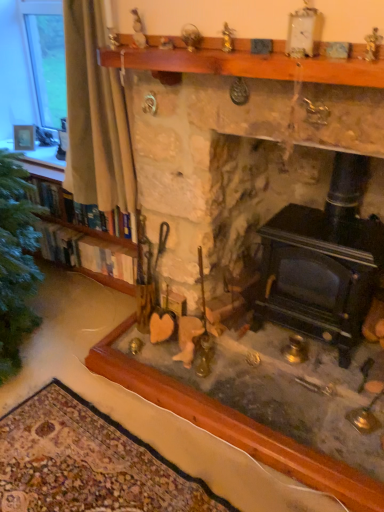
Question: Considering the relative positions of white fabric curtain at left and stone fireplace at center in the image provided, is white fabric curtain at left to the right of stone fireplace at center from the viewer's perspective?

Choices:
 (A) no
 (B) yes

Answer: (A)

Question: Considering the relative sizes of white fabric curtain at left and stone fireplace at center in the image provided, is white fabric curtain at left bigger than stone fireplace at center?

Choices:
 (A) yes
 (B) no

Answer: (B)

Question: From a real-world perspective, is white fabric curtain at left positioned under stone fireplace at center based on gravity?

Choices:
 (A) no
 (B) yes

Answer: (A)

Question: Are white fabric curtain at left and stone fireplace at center located far from each other?

Choices:
 (A) no
 (B) yes

Answer: (B)

Question: Is white fabric curtain at left thinner than stone fireplace at center?

Choices:
 (A) yes
 (B) no

Answer: (A)

Question: Is wooden bookshelf at left inside the boundaries of wooden mantle at upper center, or outside?

Choices:
 (A) outside
 (B) inside

Answer: (A)

Question: Does point (54, 223) appear closer or farther from the camera than point (299, 80)?

Choices:
 (A) farther
 (B) closer

Answer: (A)

Question: From their relative heights in the image, would you say wooden bookshelf at left is taller or shorter than wooden mantle at upper center?

Choices:
 (A) short
 (B) tall

Answer: (B)

Question: Relative to wooden mantle at upper center, is wooden bookshelf at left in front or behind?

Choices:
 (A) front
 (B) behind

Answer: (B)

Question: Is point (110, 270) closer or farther from the camera than point (307, 309)?

Choices:
 (A) closer
 (B) farther

Answer: (B)

Question: From a real-world perspective, is wooden bookshelf at left above or below black cast iron wood burning stove at lower right?

Choices:
 (A) below
 (B) above

Answer: (B)

Question: Based on their sizes in the image, would you say wooden bookshelf at left is bigger or smaller than black cast iron wood burning stove at lower right?

Choices:
 (A) big
 (B) small

Answer: (B)

Question: Relative to black cast iron wood burning stove at lower right, is wooden bookshelf at left in front or behind?

Choices:
 (A) behind
 (B) front

Answer: (A)

Question: Considering their positions, is stone fireplace at center located in front of or behind black cast iron wood burning stove at lower right?

Choices:
 (A) behind
 (B) front

Answer: (B)

Question: In terms of width, does stone fireplace at center look wider or thinner when compared to black cast iron wood burning stove at lower right?

Choices:
 (A) thin
 (B) wide

Answer: (B)